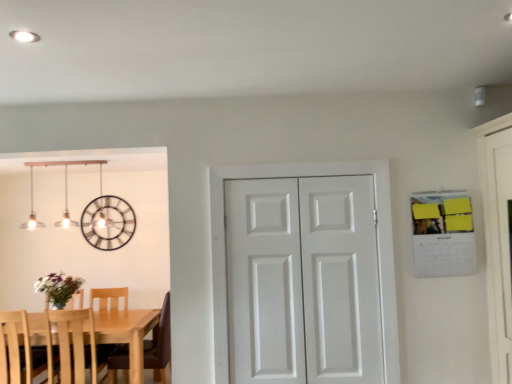
The width and height of the screenshot is (512, 384). In order to click on light wood chair at left, which ranks as the 1th chair in right-to-left order in this screenshot , I will do [75, 346].

Measure the distance between matte silver pendant lights at upper left and camera.

matte silver pendant lights at upper left and camera are 8.85 feet apart from each other.

Locate an element on the screen. This screenshot has width=512, height=384. light wood chair at left, the 2th chair when ordered from right to left is located at coordinates (18, 350).

The height and width of the screenshot is (384, 512). Identify the location of light wood chair at left, which ranks as the 1th chair in right-to-left order. (75, 346).

Considering the relative sizes of light wood chair at left, which ranks as the 1th chair in right-to-left order, and metallic clock at upper left in the image provided, is light wood chair at left, which ranks as the 1th chair in right-to-left order, bigger than metallic clock at upper left?

Indeed, light wood chair at left, which ranks as the 1th chair in right-to-left order, has a larger size compared to metallic clock at upper left.

Does light wood chair at left, the 2th chair in the left-to-right sequence, appear on the left side of metallic clock at upper left?

Incorrect, light wood chair at left, the 2th chair in the left-to-right sequence, is not on the left side of metallic clock at upper left.

From a real-world perspective, which object rests below the other?

light wood chair at left, which ranks as the 1th chair in right-to-left order.

Considering the points (85, 357) and (132, 234), which point is in front, point (85, 357) or point (132, 234)?

The point (85, 357) is closer to the camera.

Does matte silver pendant lights at upper left lie behind light wood chair at left, the 2th chair in the left-to-right sequence?

Yes, it is behind light wood chair at left, the 2th chair in the left-to-right sequence.

Is matte silver pendant lights at upper left completely or partially outside of light wood chair at left, which ranks as the 1th chair in right-to-left order?

Yes, matte silver pendant lights at upper left is located beyond the bounds of light wood chair at left, which ranks as the 1th chair in right-to-left order.

From the picture: From the image's perspective, would you say matte silver pendant lights at upper left is positioned over light wood chair at left, which ranks as the 1th chair in right-to-left order?

Indeed, from the image's perspective, matte silver pendant lights at upper left is shown above light wood chair at left, which ranks as the 1th chair in right-to-left order.

Does point (21, 227) come behind point (80, 332)?

That is True.

Measure the distance from light wood chair at left, the 2th chair when ordered from right to left, to white matte door at center, acting as the 2th screen door starting from the left.

A distance of 2.95 meters exists between light wood chair at left, the 2th chair when ordered from right to left, and white matte door at center, acting as the 2th screen door starting from the left.

Based on their sizes in the image, would you say light wood chair at left, the first chair when ordered from left to right, is bigger or smaller than white matte door at center, the first screen door from the right?

light wood chair at left, the first chair when ordered from left to right, is bigger than white matte door at center, the first screen door from the right.

Is light wood chair at left, the 2th chair when ordered from right to left, spatially inside white matte door at center, the first screen door from the right, or outside of it?

light wood chair at left, the 2th chair when ordered from right to left, is spatially situated outside white matte door at center, the first screen door from the right.

Is light wood chair at left, the 2th chair when ordered from right to left, at the right side of white matte door at center, the first screen door from the right?

No, light wood chair at left, the 2th chair when ordered from right to left, is not to the right of white matte door at center, the first screen door from the right.

Is light wood table at lower left positioned before white matte door at center, the first screen door from the right?

No.

Is light wood table at lower left oriented towards white matte door at center, the first screen door from the right?

No, light wood table at lower left is not oriented towards white matte door at center, the first screen door from the right.

Looking at this image, is light wood table at lower left beside white matte door at center, the first screen door from the right?

No, light wood table at lower left is not making contact with white matte door at center, the first screen door from the right.

Which is more to the right, light wood table at lower left or white matte door at center, acting as the 2th screen door starting from the left?

Positioned to the right is white matte door at center, acting as the 2th screen door starting from the left.

Consider the image. Based on their sizes in the image, would you say metallic clock at upper left is bigger or smaller than light wood chair at left, the first chair when ordered from left to right?

Clearly, metallic clock at upper left is smaller in size than light wood chair at left, the first chair when ordered from left to right.

Which object is more forward, metallic clock at upper left or light wood chair at left, the first chair when ordered from left to right?

light wood chair at left, the first chair when ordered from left to right, is closer to the camera.

The width and height of the screenshot is (512, 384). I want to click on clock above the light wood chair at left, the 2th chair when ordered from right to left (from a real-world perspective), so click(108, 223).

Looking at this image, can you confirm if metallic clock at upper left is taller than light wood chair at left, the first chair when ordered from left to right?

Incorrect, the height of metallic clock at upper left is not larger of that of light wood chair at left, the first chair when ordered from left to right.

Considering the relative sizes of light wood chair at left, which ranks as the 1th chair in right-to-left order, and light wood table at lower left in the image provided, is light wood chair at left, which ranks as the 1th chair in right-to-left order, taller than light wood table at lower left?

Correct, light wood chair at left, which ranks as the 1th chair in right-to-left order, is much taller as light wood table at lower left.

Does light wood chair at left, which ranks as the 1th chair in right-to-left order, have a greater width compared to light wood table at lower left?

In fact, light wood chair at left, which ranks as the 1th chair in right-to-left order, might be narrower than light wood table at lower left.

From the picture: Considering the relative positions of light wood chair at left, which ranks as the 1th chair in right-to-left order, and light wood table at lower left in the image provided, is light wood chair at left, which ranks as the 1th chair in right-to-left order, to the right of light wood table at lower left from the viewer's perspective?

Yes.

Is matte silver pendant lights at upper left looking in the opposite direction of metallic clock at upper left?

Absolutely, matte silver pendant lights at upper left is directed away from metallic clock at upper left.

In the image, there is a metallic clock at upper left. Identify the location of lamp above it (from the image's perspective). Image resolution: width=512 pixels, height=384 pixels. (65, 193).

From a real-world perspective, is matte silver pendant lights at upper left physically located above or below metallic clock at upper left?

In terms of real-world spatial position, matte silver pendant lights at upper left is above metallic clock at upper left.

Image resolution: width=512 pixels, height=384 pixels. What are the coordinates of `clock behind the light wood chair at left, which ranks as the 1th chair in right-to-left order` in the screenshot? It's located at (108, 223).

From a real-world perspective, starting from the matte silver pendant lights at upper left, which chair is the 2nd one below it? Please provide its 2D coordinates.

[(75, 346)]

Estimate the real-world distances between objects in this image. Which object is further from light wood chair at left, the 2th chair when ordered from right to left, matte silver pendant lights at upper left or white matte door at center?

white matte door at center lies further to light wood chair at left, the 2th chair when ordered from right to left, than the other object.

When comparing their distances from white matte door at center, which is the 1th screen door in left-to-right order, does matte silver pendant lights at upper left or white matte door at center seem closer?

The object closer to white matte door at center, which is the 1th screen door in left-to-right order, is white matte door at center.

Estimate the real-world distances between objects in this image. Which object is closer to white matte door at center, acting as the 2th screen door starting from the left, light wood table at lower left or light wood chair at left, which ranks as the 1th chair in right-to-left order?

light wood table at lower left is closer to white matte door at center, acting as the 2th screen door starting from the left.

Considering their positions, is white matte door at center, the first screen door from the right, positioned closer to metallic clock at upper left than white matte door at center?

The object closer to metallic clock at upper left is white matte door at center.

When comparing their distances from light wood chair at left, the 2th chair when ordered from right to left, does matte silver pendant lights at upper left or white matte door at center, acting as the 2th screen door starting from the left, seem closer?

matte silver pendant lights at upper left.

Looking at the image, which one is located closer to metallic clock at upper left, light wood table at lower left or white matte door at center, which is the second screen door from right to left?

The object closer to metallic clock at upper left is light wood table at lower left.

Based on the photo, from the image, which object appears to be farther from white matte door at center, which is the second screen door from right to left, light wood chair at left, the 2th chair when ordered from right to left, or matte silver pendant lights at upper left?

The object further to white matte door at center, which is the second screen door from right to left, is light wood chair at left, the 2th chair when ordered from right to left.

When comparing their distances from light wood chair at left, the 2th chair in the left-to-right sequence, does white matte door at center, acting as the 2th screen door starting from the left, or light wood chair at left, the 2th chair when ordered from right to left, seem further?

Among the two, white matte door at center, acting as the 2th screen door starting from the left, is located further to light wood chair at left, the 2th chair in the left-to-right sequence.

At what (x,y) coordinates should I click in order to perform the action: click on door located between light wood chair at left, the 2th chair when ordered from right to left, and white matte door at center, the first screen door from the right, in the left-right direction. Please return your answer as a coordinate pair (x, y). This screenshot has width=512, height=384. Looking at the image, I should click on (305, 176).

This screenshot has height=384, width=512. What are the coordinates of `lamp between light wood table at lower left and white matte door at center, which is the second screen door from right to left, from left to right` in the screenshot? It's located at (65, 193).

Identify the location of chair between light wood table at lower left and metallic clock at upper left from front to back. Image resolution: width=512 pixels, height=384 pixels. (18, 350).

Find the location of `screen door between light wood table at lower left and white matte door at center from left to right`. screen door between light wood table at lower left and white matte door at center from left to right is located at coordinates (264, 281).